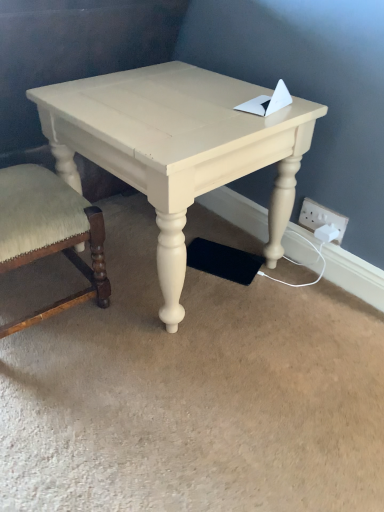
Where is `free location above matte cream table at center (from a real-world perspective)`? The width and height of the screenshot is (384, 512). free location above matte cream table at center (from a real-world perspective) is located at coordinates (174, 96).